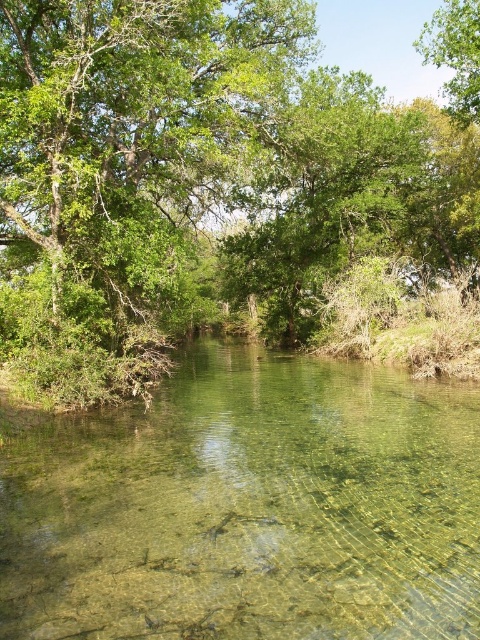
Question: Estimate the real-world distances between objects in this image. Which object is closer to the green leafy tree at upper right?

Choices:
 (A) clear glassy river at center
 (B) green leafy tree at center

Answer: (B)

Question: Among these objects, which one is farthest from the camera?

Choices:
 (A) green leafy tree at upper right
 (B) green leafy tree at center

Answer: (A)

Question: Among these points, which one is nearest to the camera?

Choices:
 (A) (454, 13)
 (B) (117, 8)

Answer: (B)

Question: In this image, where is green leafy tree at center located relative to clear glassy river at center?

Choices:
 (A) right
 (B) left

Answer: (A)

Question: Can you confirm if green leafy tree at center is positioned to the right of clear glassy river at center?

Choices:
 (A) yes
 (B) no

Answer: (A)

Question: Observing the image, what is the correct spatial positioning of green leafy tree at center in reference to clear glassy river at center?

Choices:
 (A) left
 (B) right

Answer: (B)